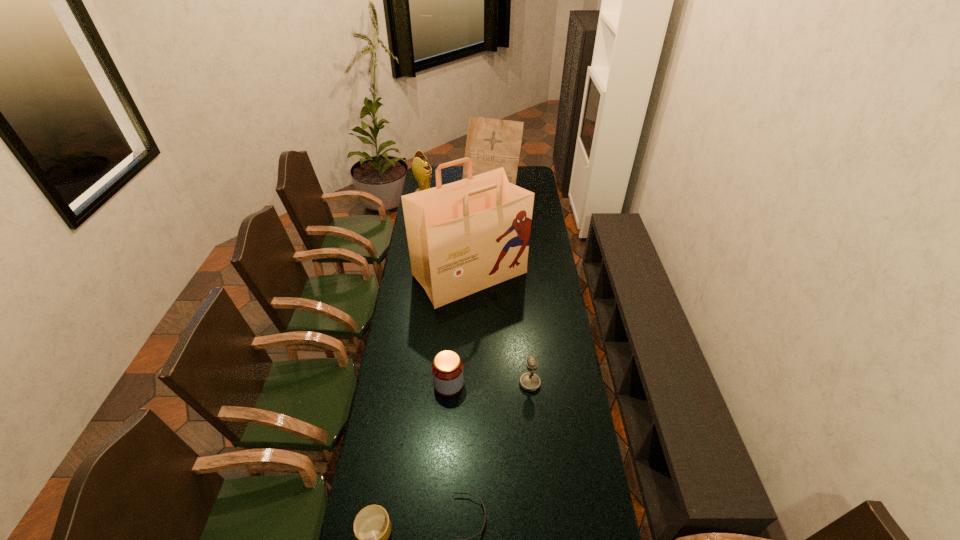
The height and width of the screenshot is (540, 960). Find the location of `free spot located on the front-facing side of the microphone`. free spot located on the front-facing side of the microphone is located at coordinates (503, 383).

The height and width of the screenshot is (540, 960). Find the location of `vacant area located 0.330m on the front-facing side of the microphone`. vacant area located 0.330m on the front-facing side of the microphone is located at coordinates (432, 383).

The height and width of the screenshot is (540, 960). I want to click on vacant region located 0.230m on the front-facing side of the microphone, so click(459, 383).

Locate an element on the screen. vacant area situated 0.240m on the back of the jar is located at coordinates (452, 324).

Identify the location of object located in the far edge section of the desktop. (491, 143).

Identify the location of grocery bag that is positioned at the left edge. This screenshot has width=960, height=540. (463, 237).

The image size is (960, 540). I want to click on award at the left edge, so click(x=421, y=172).

You are a GUI agent. You are given a task and a screenshot of the screen. Output one action in this format:
    pyautogui.click(x=<x>, y=<y>)
    Task: Click on the microphone positioned at the right edge
    The height and width of the screenshot is (540, 960).
    Given the screenshot: What is the action you would take?
    pyautogui.click(x=529, y=381)

The width and height of the screenshot is (960, 540). I want to click on object that is at the far right corner, so click(491, 143).

Locate an element on the screen. The width and height of the screenshot is (960, 540). vacant space at the left edge of the desktop is located at coordinates (409, 284).